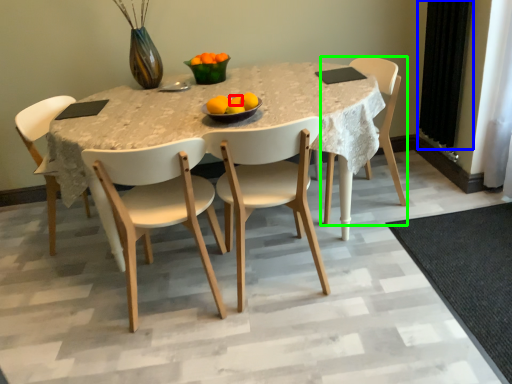
Question: Which object is positioned farthest from orange (highlighted by a red box)? Select from curtain (highlighted by a blue box) and chair (highlighted by a green box).

Choices:
 (A) curtain
 (B) chair

Answer: (A)